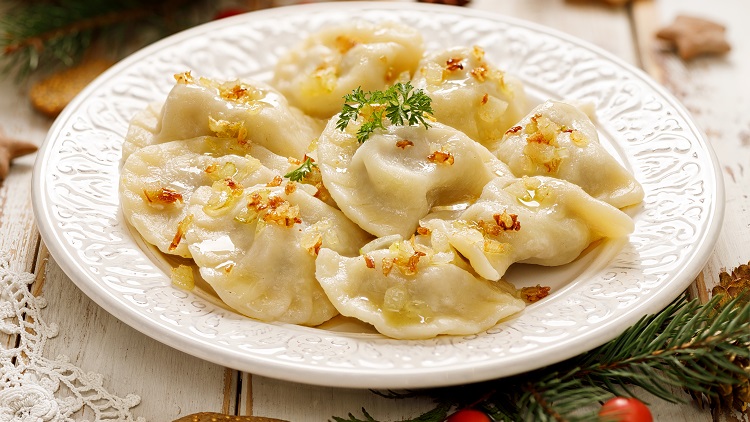
You are a GUI agent. You are given a task and a screenshot of the screen. Output one action in this format:
    pyautogui.click(x=<x>, y=<y>)
    Task: Click on the lace doily
    The image size is (750, 422).
    Given the screenshot: What is the action you would take?
    pyautogui.click(x=376, y=5), pyautogui.click(x=22, y=410), pyautogui.click(x=16, y=296), pyautogui.click(x=98, y=397)